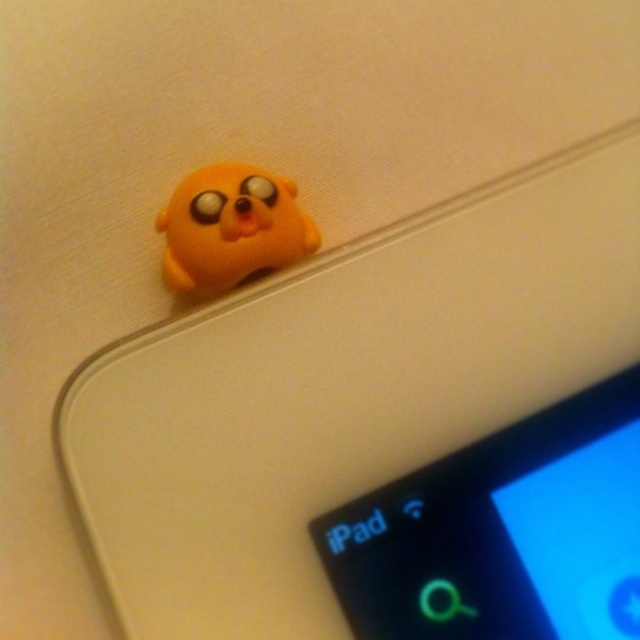
Question: From the image, what is the correct spatial relationship of matte black ipad at upper left in relation to matte yellow toy at upper left?

Choices:
 (A) above
 (B) below

Answer: (B)

Question: Is matte black ipad at upper left positioned in front of matte yellow toy at upper left?

Choices:
 (A) yes
 (B) no

Answer: (A)

Question: Among these points, which one is nearest to the camera?

Choices:
 (A) (241, 211)
 (B) (392, 588)

Answer: (B)

Question: Which of the following is the farthest from the observer?

Choices:
 (A) (189, 252)
 (B) (605, 472)

Answer: (A)

Question: Which point appears closest to the camera in this image?

Choices:
 (A) (192, 198)
 (B) (611, 438)

Answer: (B)

Question: Can you confirm if matte black ipad at upper left is positioned to the right of matte yellow toy at upper left?

Choices:
 (A) no
 (B) yes

Answer: (B)